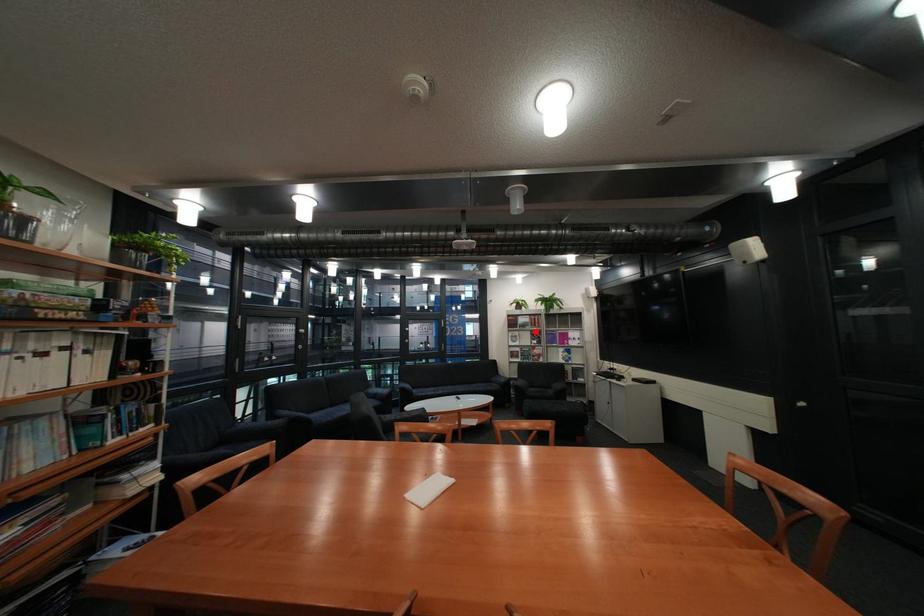
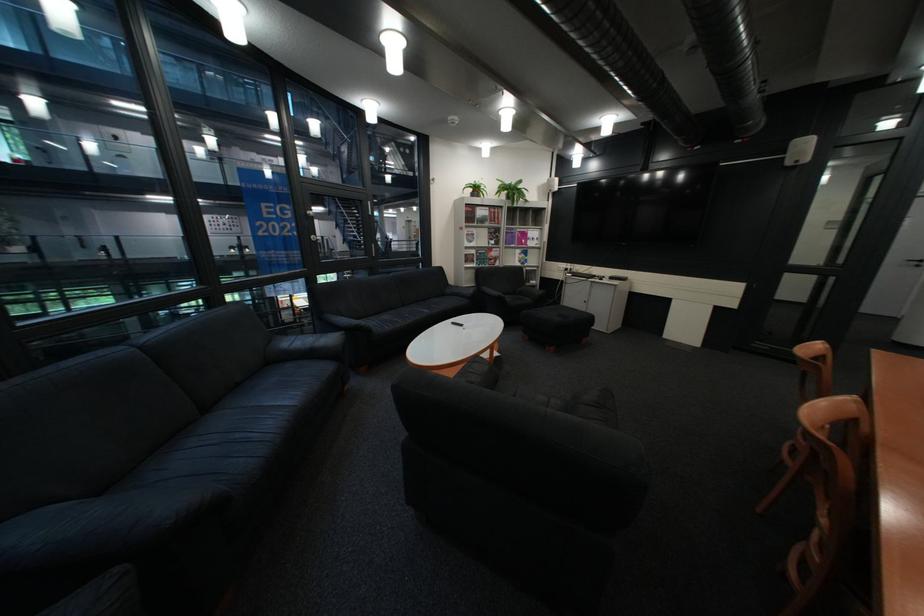
Find the pixel in the second image that matches the highlighted location in the first image.

(492, 229)